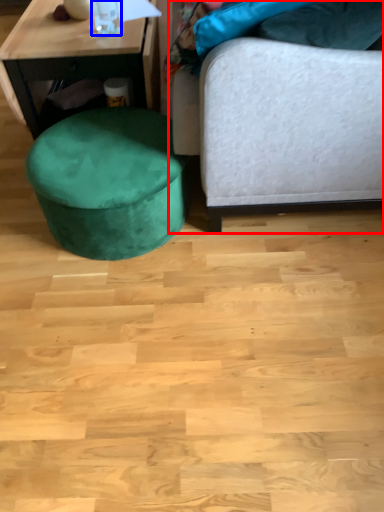
Question: Which point is closer to the camera, studio couch (highlighted by a red box) or bottle (highlighted by a blue box)?

Choices:
 (A) studio couch
 (B) bottle

Answer: (A)